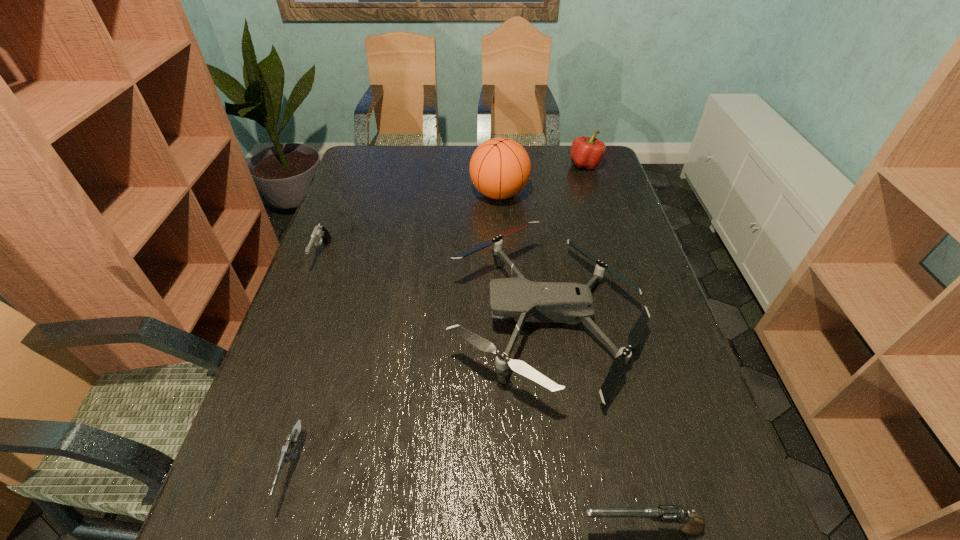
This screenshot has height=540, width=960. Find the location of `free space at the far right corner of the desktop`. free space at the far right corner of the desktop is located at coordinates (565, 153).

Locate an element on the screen. The height and width of the screenshot is (540, 960). empty location between the fifth nearest object and the rightmost gun is located at coordinates (570, 361).

Where is `free space that is in between the nearest object and the farthest gun`? Image resolution: width=960 pixels, height=540 pixels. free space that is in between the nearest object and the farthest gun is located at coordinates (481, 392).

Locate an element on the screen. Image resolution: width=960 pixels, height=540 pixels. unoccupied position between the drone and the fifth nearest object is located at coordinates (522, 256).

Find the location of a particular element. The image size is (960, 540). blank region between the tallest object and the nearest gun is located at coordinates (570, 361).

Where is `vacant space in between the nearest object and the fifth object from right to left`? This screenshot has height=540, width=960. vacant space in between the nearest object and the fifth object from right to left is located at coordinates (468, 498).

In order to click on vacant space in between the basketball and the nearest object in this screenshot , I will do `click(570, 361)`.

This screenshot has height=540, width=960. I want to click on free spot between the farthest object and the leftmost gun, so click(454, 210).

Locate an element on the screen. vacant region between the farthest object and the second gun from right to left is located at coordinates (441, 317).

Where is `unoccupied position between the tallest object and the second gun from right to left`? The height and width of the screenshot is (540, 960). unoccupied position between the tallest object and the second gun from right to left is located at coordinates (397, 331).